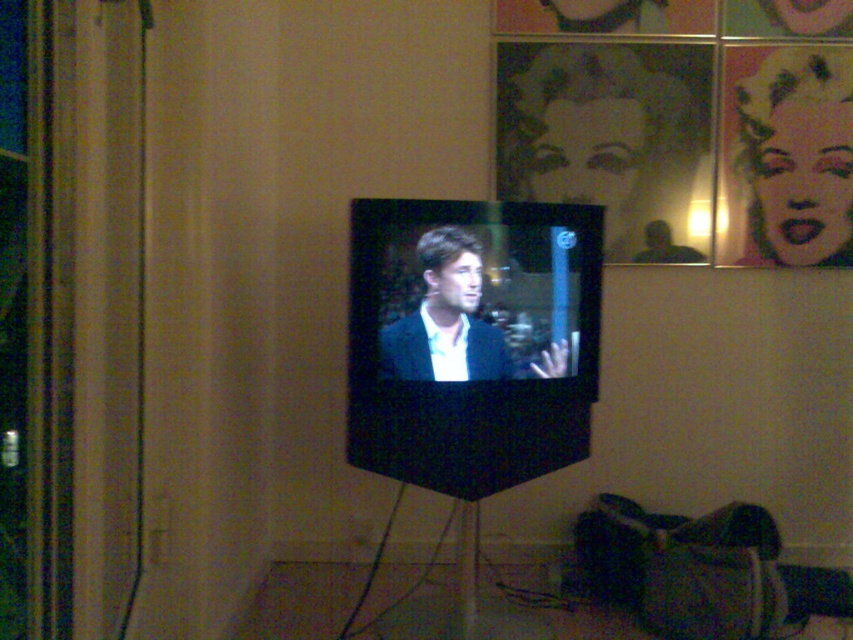
Is metallic silver portrait at upper center smaller than matte black portrait at upper right?

No, metallic silver portrait at upper center is not smaller than matte black portrait at upper right.

Is point (560, 173) positioned after point (759, 218)?

Yes, it is behind point (759, 218).

You are a GUI agent. You are given a task and a screenshot of the screen. Output one action in this format:
    pyautogui.click(x=<x>, y=<y>)
    Task: Click on the metallic silver portrait at upper center
    
    Given the screenshot: What is the action you would take?
    pyautogui.click(x=612, y=140)

Can you confirm if matte black portrait at upper right is thinner than matte black suit at center?

Correct, matte black portrait at upper right's width is less than matte black suit at center's.

The height and width of the screenshot is (640, 853). What do you see at coordinates (798, 154) in the screenshot? I see `matte black portrait at upper right` at bounding box center [798, 154].

Locate an element on the screen. matte black portrait at upper right is located at coordinates (798, 154).

Does point (614, 204) come farther from viewer compared to point (460, 330)?

Yes.

Which is more to the right, metallic silver portrait at upper center or matte black suit at center?

Positioned to the right is metallic silver portrait at upper center.

Who is more distant from viewer, (502, 61) or (445, 333)?

The point (502, 61) is more distant.

I want to click on metallic silver portrait at upper center, so click(612, 140).